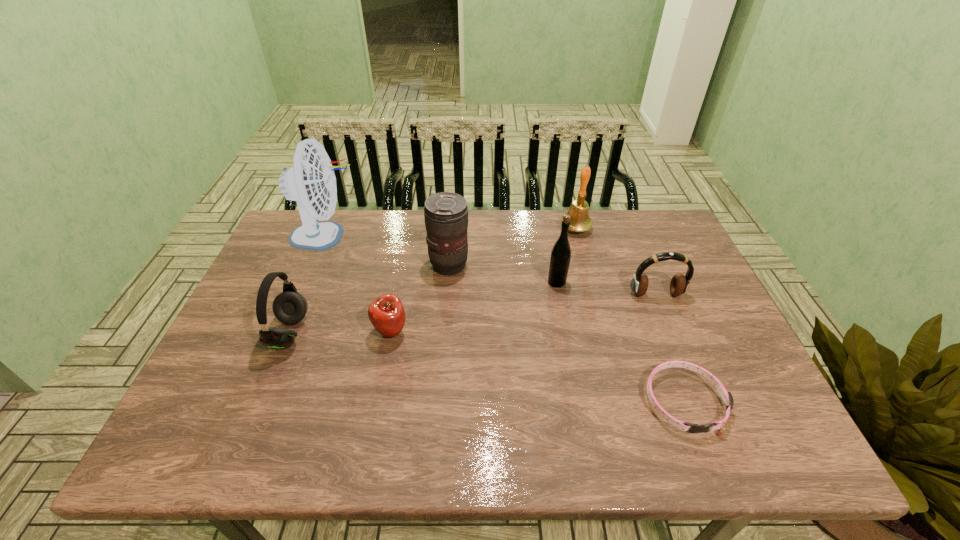
The width and height of the screenshot is (960, 540). Identify the location of empty space that is in between the nearer headset and the telephoto lens. (370, 299).

Find the location of a particular element. The width and height of the screenshot is (960, 540). empty space that is in between the nearer headset and the sixth object from left to right is located at coordinates (433, 281).

Where is `free space that is in between the apple and the fan`? This screenshot has height=540, width=960. free space that is in between the apple and the fan is located at coordinates [x=359, y=284].

Find the location of `vacant space that is in between the taller headset and the third object from right to left`. vacant space that is in between the taller headset and the third object from right to left is located at coordinates (433, 281).

Select which object appears as the seventh closest to the fifth object from right to left. Please provide its 2D coordinates. Your answer should be formatted as a tuple, i.e. [(x, y)], where the tuple contains the x and y coordinates of a point satisfying the conditions above.

[(727, 397)]

Choose which object is the sixth nearest neighbor to the fifth object from right to left. Please provide its 2D coordinates. Your answer should be formatted as a tuple, i.e. [(x, y)], where the tuple contains the x and y coordinates of a point satisfying the conditions above.

[(679, 284)]

The width and height of the screenshot is (960, 540). Identify the location of vacant position in the image that satisfies the following two spatial constraints: 1. on the grille of the tallest object; 2. on the left side of the beer bottle. (307, 282).

Where is `free spot that satisfies the following two spatial constraints: 1. on the front side of the apple; 2. on the ear cups of the left headset`? This screenshot has height=540, width=960. free spot that satisfies the following two spatial constraints: 1. on the front side of the apple; 2. on the ear cups of the left headset is located at coordinates (391, 333).

Where is `blank space that satisfies the following two spatial constraints: 1. on the grille of the tallest object; 2. on the right side of the sixth object from right to left`? Image resolution: width=960 pixels, height=540 pixels. blank space that satisfies the following two spatial constraints: 1. on the grille of the tallest object; 2. on the right side of the sixth object from right to left is located at coordinates (286, 332).

The height and width of the screenshot is (540, 960). What are the coordinates of `free space in the image that satisfies the following two spatial constraints: 1. on the back side of the bell; 2. on the left side of the beer bottle` in the screenshot? It's located at (547, 228).